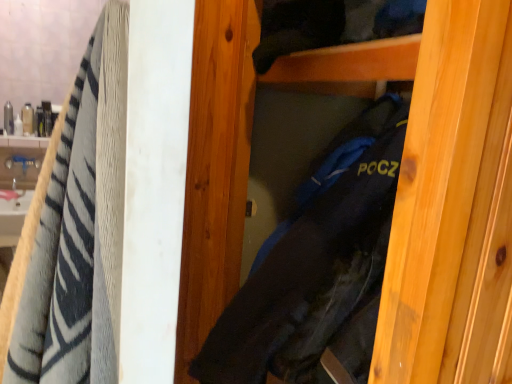
Question: Is white glossy sink at left not near black fabric bag at center?

Choices:
 (A) yes
 (B) no

Answer: (A)

Question: From the image's perspective, is white glossy sink at left beneath black fabric bag at center?

Choices:
 (A) no
 (B) yes

Answer: (B)

Question: Does white glossy sink at left have a greater height compared to black fabric bag at center?

Choices:
 (A) yes
 (B) no

Answer: (B)

Question: Would you say white glossy sink at left is outside black fabric bag at center?

Choices:
 (A) no
 (B) yes

Answer: (B)

Question: Is white glossy sink at left wider than black fabric bag at center?

Choices:
 (A) no
 (B) yes

Answer: (A)

Question: Does white glossy sink at left have a larger size compared to black fabric bag at center?

Choices:
 (A) no
 (B) yes

Answer: (A)

Question: Is white glossy sink at left taller than soft cotton towel at left?

Choices:
 (A) yes
 (B) no

Answer: (B)

Question: Is white glossy sink at left to the left of soft cotton towel at left from the viewer's perspective?

Choices:
 (A) yes
 (B) no

Answer: (A)

Question: Is white glossy sink at left located outside soft cotton towel at left?

Choices:
 (A) yes
 (B) no

Answer: (A)

Question: Is white glossy sink at left bigger than soft cotton towel at left?

Choices:
 (A) no
 (B) yes

Answer: (A)

Question: Can you confirm if white glossy sink at left is shorter than soft cotton towel at left?

Choices:
 (A) yes
 (B) no

Answer: (A)

Question: Does white glossy sink at left appear on the right side of soft cotton towel at left?

Choices:
 (A) no
 (B) yes

Answer: (A)

Question: Could you tell me if black fabric bag at center is facing white glossy sink at left?

Choices:
 (A) no
 (B) yes

Answer: (A)